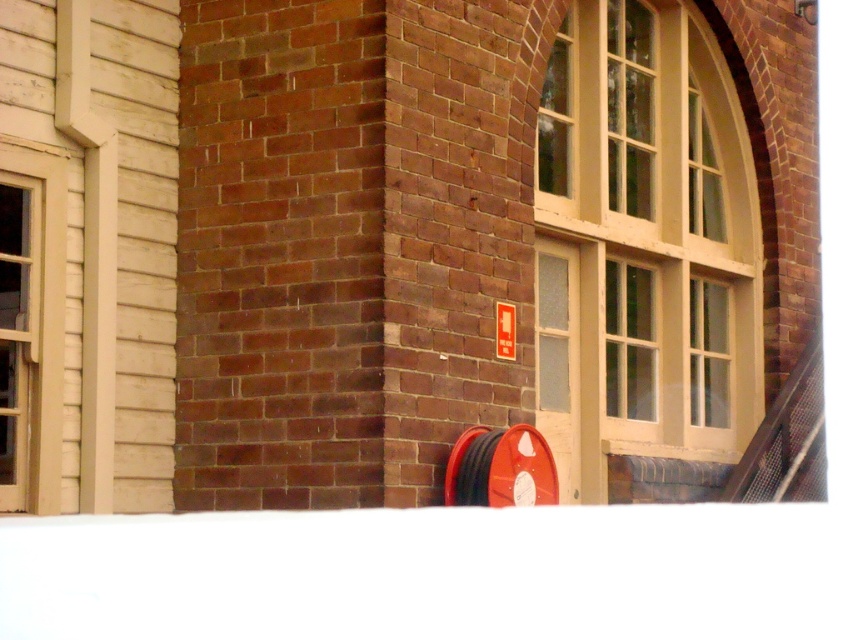
Question: In this image, where is matte cream window at center located relative to red plastic sign at center?

Choices:
 (A) left
 (B) right

Answer: (B)

Question: Among these objects, which one is farthest from the camera?

Choices:
 (A) red plastic sign at center
 (B) matte cream window at center
 (C) metal mesh rail at lower right

Answer: (C)

Question: Which point is farther from the camera taking this photo?

Choices:
 (A) (61, 179)
 (B) (740, 224)
 (C) (799, 410)
 (D) (502, 330)

Answer: (B)

Question: Which object appears farthest from the camera in this image?

Choices:
 (A) matte beige window at left
 (B) metal mesh rail at lower right

Answer: (B)

Question: Can you confirm if metal mesh rail at lower right is thinner than red plastic sign at center?

Choices:
 (A) yes
 (B) no

Answer: (B)

Question: Is metal mesh rail at lower right to the right of red plastic sign at center from the viewer's perspective?

Choices:
 (A) no
 (B) yes

Answer: (B)